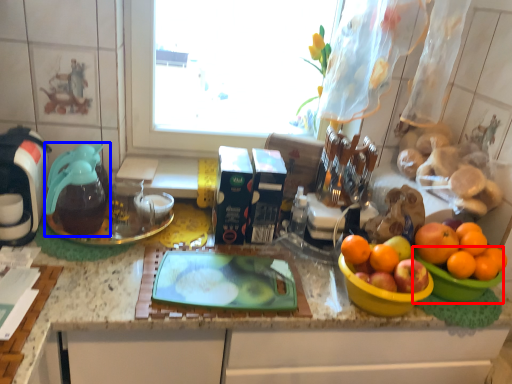
Question: Which object appears farthest to the camera in this image, basin (highlighted by a red box) or coffeepot (highlighted by a blue box)?

Choices:
 (A) basin
 (B) coffeepot

Answer: (B)